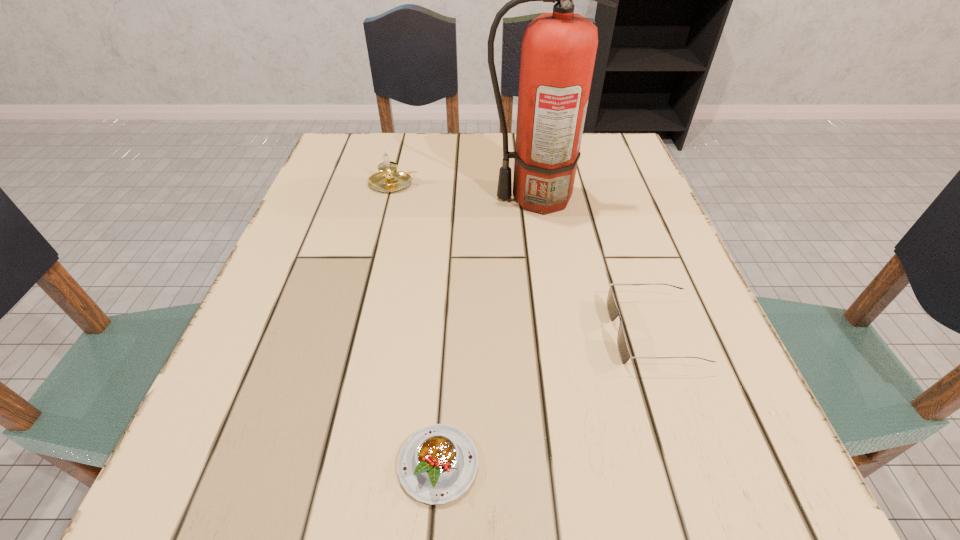
I want to click on object that is at the far left corner, so click(386, 180).

Identify the location of object that is at the far right corner. (558, 50).

In the image, there is a desktop. Where is `vacant space at the far edge`? vacant space at the far edge is located at coordinates (415, 183).

Where is `vacant space at the left edge of the desktop`? vacant space at the left edge of the desktop is located at coordinates (320, 201).

Find the location of a particular element. The height and width of the screenshot is (540, 960). free spot at the right edge of the desktop is located at coordinates (620, 264).

Find the location of a particular element. vacant space at the far left corner of the desktop is located at coordinates (389, 138).

Locate an element on the screen. free space at the far right corner of the desktop is located at coordinates (629, 166).

At what (x,y) coordinates should I click in order to perform the action: click on free space at the near right corner. Please return your answer as a coordinate pair (x, y). This screenshot has height=540, width=960. Looking at the image, I should click on (678, 476).

Find the location of a particular element. empty location between the nearest object and the fire extinguisher is located at coordinates (487, 331).

This screenshot has height=540, width=960. Identify the location of vacant area that lies between the candle holder and the nearest object. (416, 324).